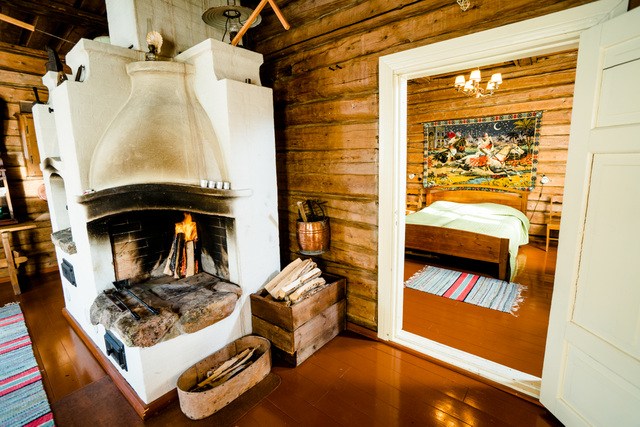
You are a GUI agent. You are given a task and a screenshot of the screen. Output one action in this format:
    pyautogui.click(x=<x>, y=<y>)
    Task: Click on the tapestry
    The width and height of the screenshot is (640, 427).
    Given the screenshot: What is the action you would take?
    pyautogui.click(x=475, y=150)